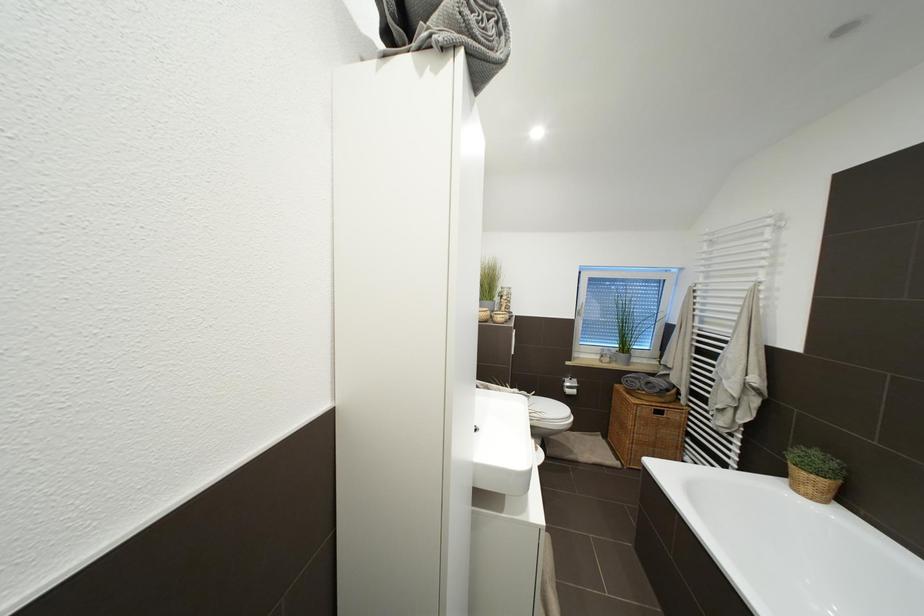
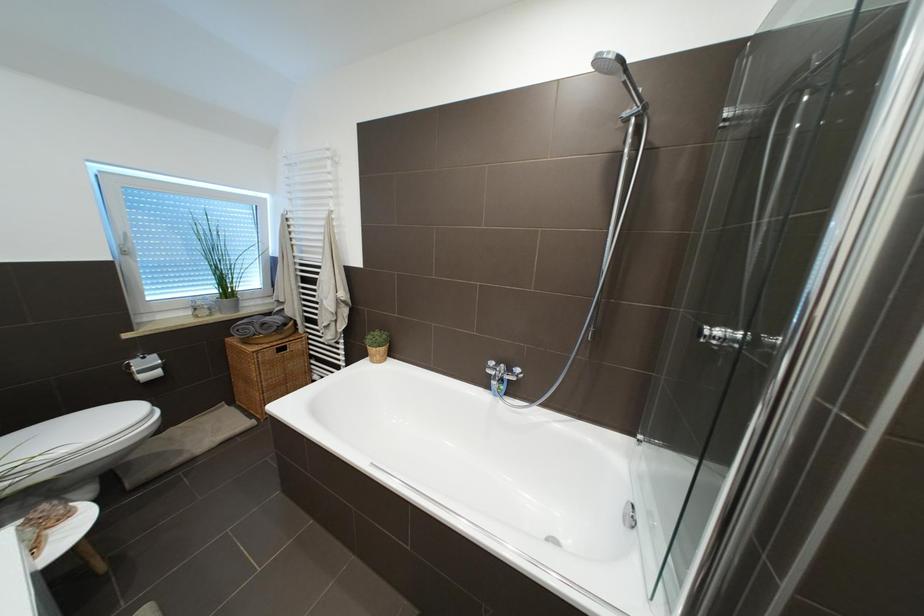
How did the camera likely rotate?

The camera rotated toward right-down.